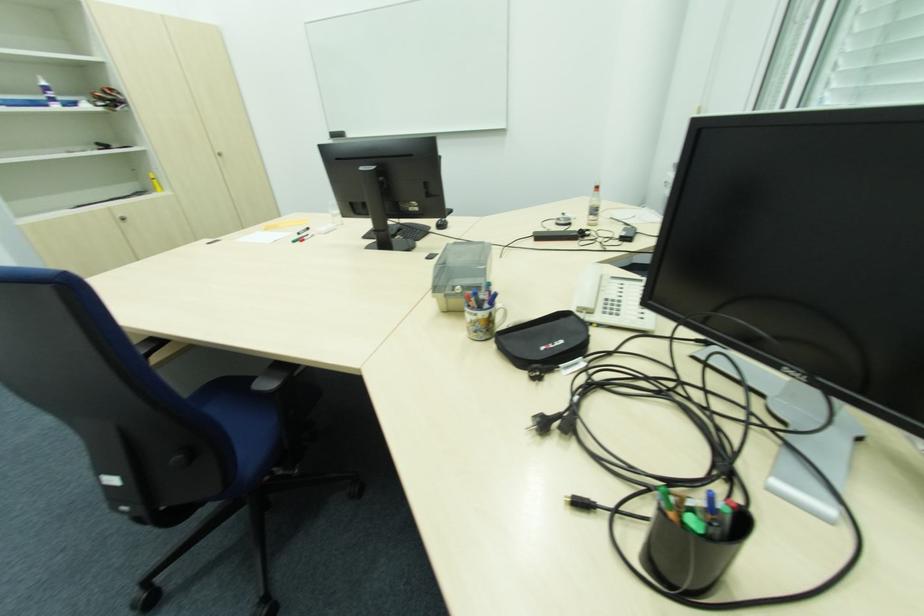
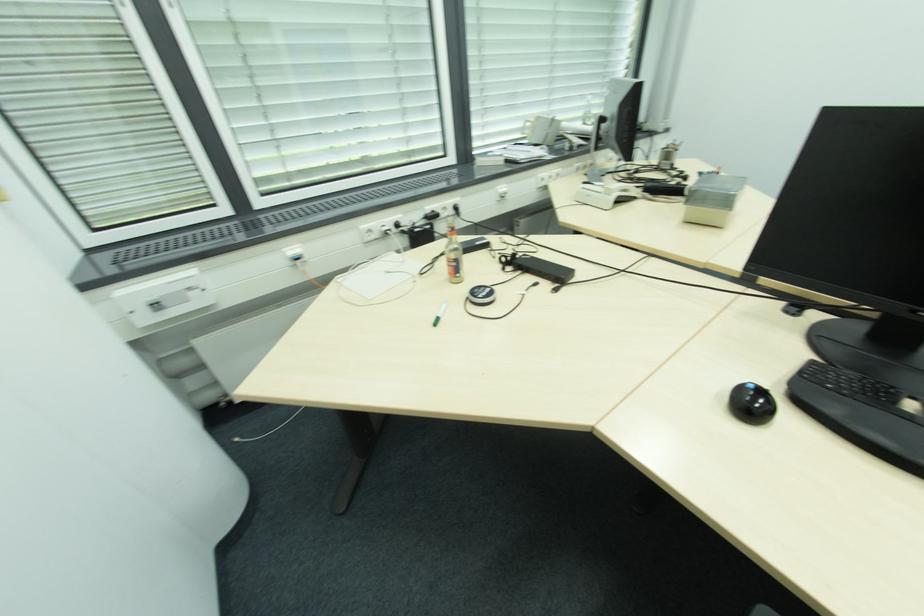
Locate, in the second image, the point that corresponds to (x=567, y=213) in the first image.

(436, 321)